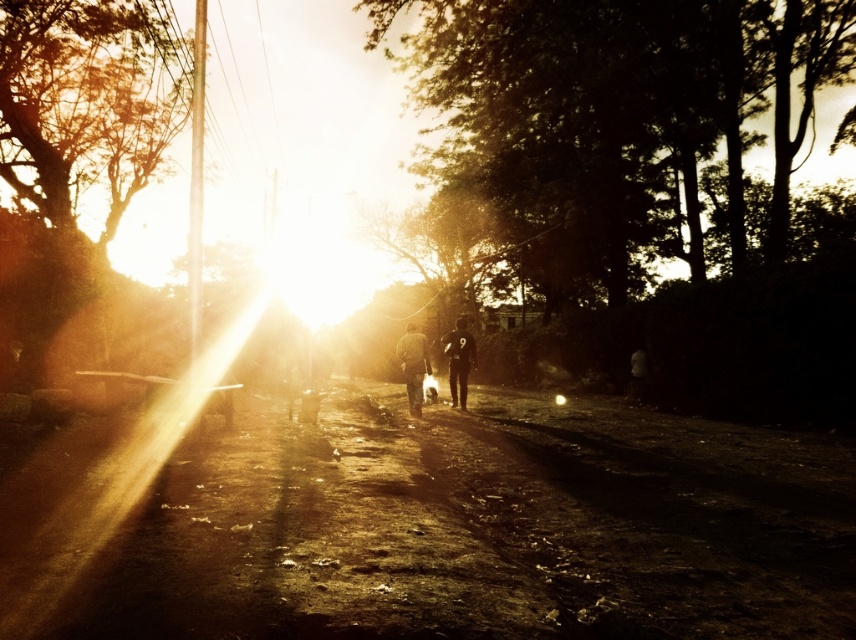
You are standing at the point labeled point (485, 529) in the image. What is the surface you are currently standing on?

The point (485, 529) is on dusty brown dirt track at center, so you are standing on a dusty brown dirt track.

You are standing at the starting point of the dirt path in the image. There are two points marked on the path, one at coordinates point (107, 45) and another at point (412, 358). Which point is closer to you as you face the path leading towards the horizon?

Point (412, 358) is closer to you because it is in front of point (107, 45), which is further away.